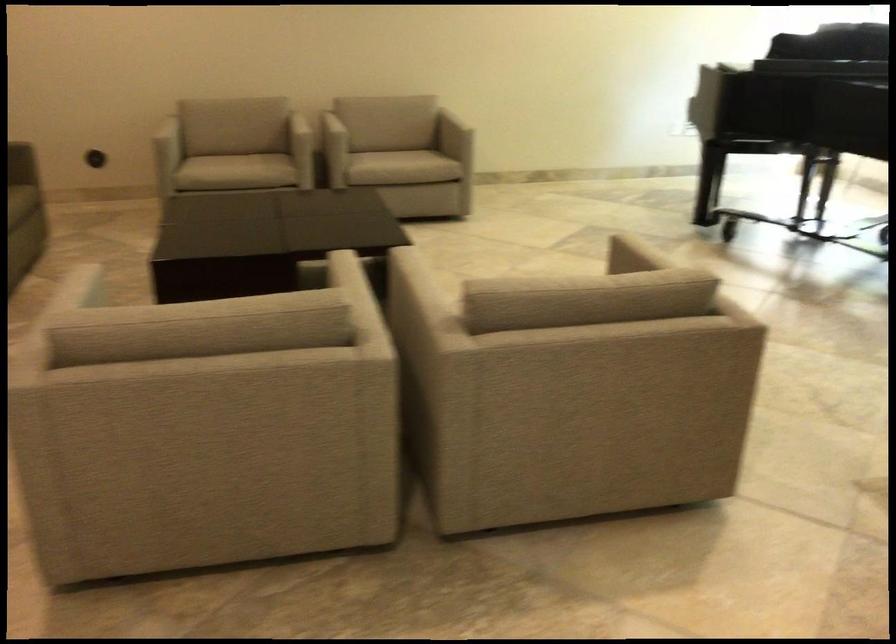
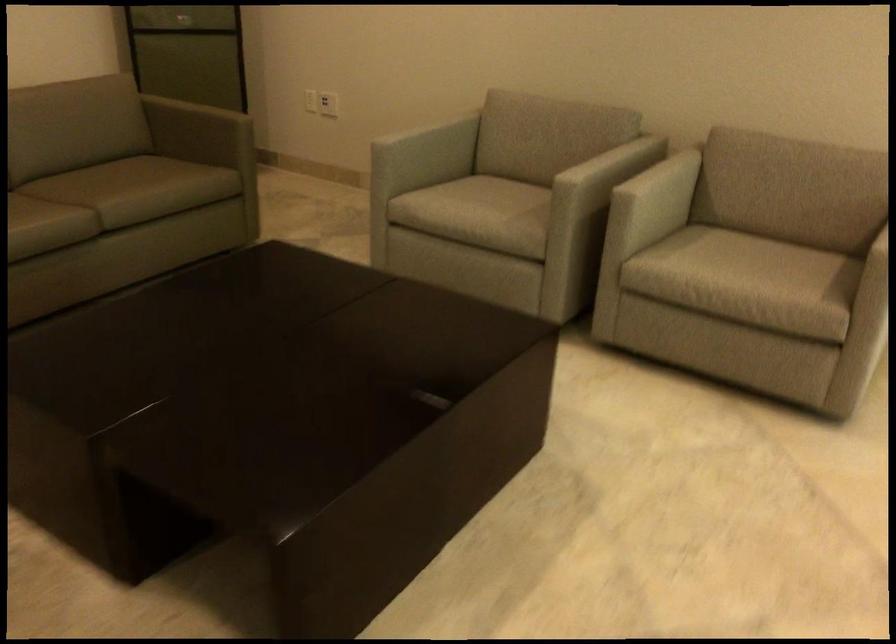
Where in the second image is the point corresponding to point (238, 161) from the first image?

(480, 207)